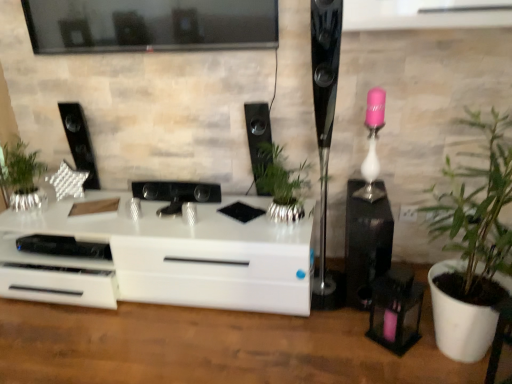
Question: Should I look upward or downward to see polished black speaker at right, the third speaker viewed from the left?

Choices:
 (A) up
 (B) down

Answer: (A)

Question: Can white glossy chest of drawers at center be found inside green leafy plant at right, the 1th houseplant when ordered from right to left?

Choices:
 (A) yes
 (B) no

Answer: (B)

Question: Can you confirm if green leafy plant at right, the 1th houseplant when ordered from right to left, is smaller than white glossy chest of drawers at center?

Choices:
 (A) yes
 (B) no

Answer: (A)

Question: From a real-world perspective, is green leafy plant at right, the 1th houseplant when ordered from right to left, below white glossy chest of drawers at center?

Choices:
 (A) yes
 (B) no

Answer: (B)

Question: Is green leafy plant at right, which is counted as the 3th houseplant, starting from the left, bigger than white glossy chest of drawers at center?

Choices:
 (A) no
 (B) yes

Answer: (A)

Question: From a real-world perspective, is green leafy plant at right, which is counted as the 3th houseplant, starting from the left, located higher than white glossy chest of drawers at center?

Choices:
 (A) no
 (B) yes

Answer: (B)

Question: From the image's perspective, is green leafy plant at right, the 1th houseplant when ordered from right to left, over white glossy chest of drawers at center?

Choices:
 (A) yes
 (B) no

Answer: (A)

Question: Is black glossy speaker at center, which ranks as the 3th speaker in right-to-left order, far from green leafy plant at right, the 1th houseplant when ordered from right to left?

Choices:
 (A) yes
 (B) no

Answer: (B)

Question: Does black glossy speaker at center, which appears as the 2th speaker when viewed from the left, touch green leafy plant at right, the 1th houseplant when ordered from right to left?

Choices:
 (A) no
 (B) yes

Answer: (A)

Question: Can you confirm if black glossy speaker at center, which ranks as the 3th speaker in right-to-left order, is bigger than green leafy plant at right, the 1th houseplant when ordered from right to left?

Choices:
 (A) yes
 (B) no

Answer: (B)

Question: Does black glossy speaker at center, which ranks as the 3th speaker in right-to-left order, have a greater width compared to green leafy plant at right, the 1th houseplant when ordered from right to left?

Choices:
 (A) yes
 (B) no

Answer: (B)

Question: Can you confirm if black glossy speaker at center, which appears as the 2th speaker when viewed from the left, is smaller than green leafy plant at right, the 1th houseplant when ordered from right to left?

Choices:
 (A) no
 (B) yes

Answer: (B)

Question: Does black glossy speaker at center, which appears as the 2th speaker when viewed from the left, have a lesser width compared to green leafy plant at right, which is counted as the 3th houseplant, starting from the left?

Choices:
 (A) no
 (B) yes

Answer: (B)

Question: Can you confirm if polished black speaker at right, the third speaker viewed from the left, is bigger than silver metallic plant at left, which ranks as the 1th houseplant in left-to-right order?

Choices:
 (A) yes
 (B) no

Answer: (A)